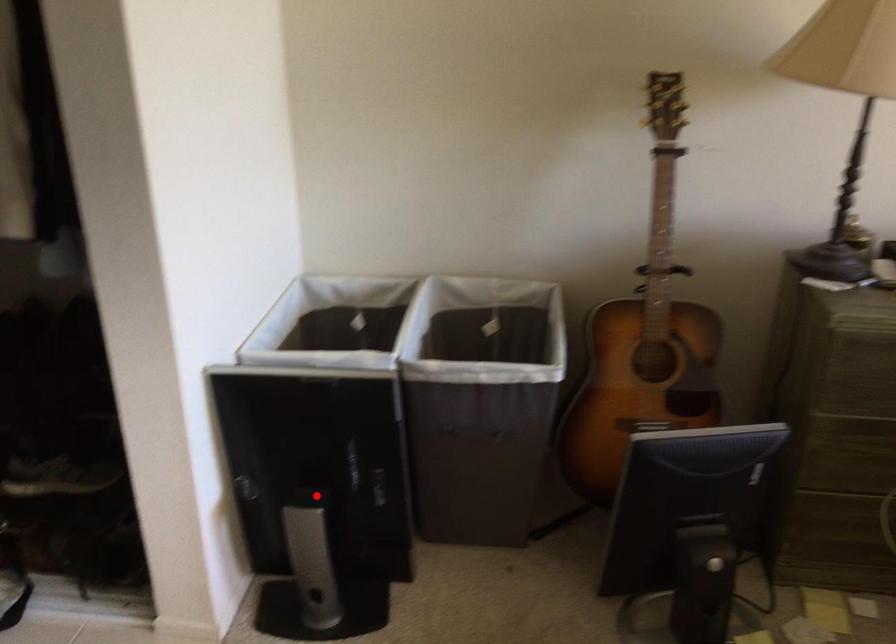
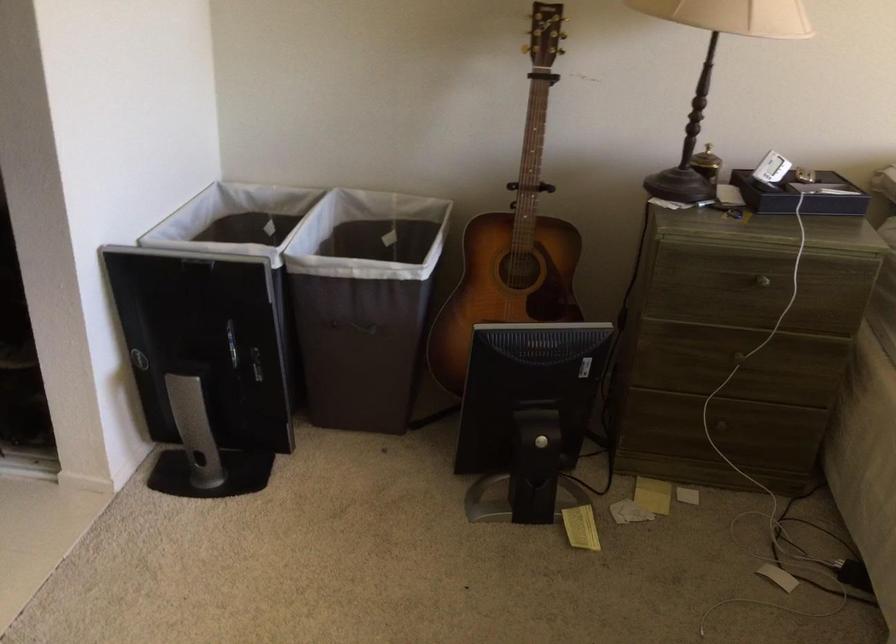
Find the pixel in the second image that matches the highlighted location in the first image.

(203, 365)